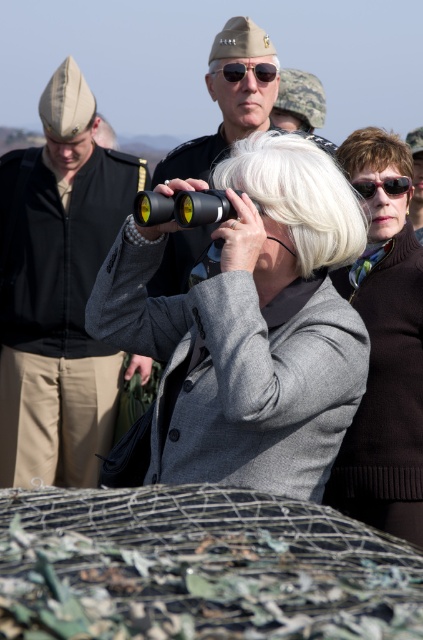
Question: Which object appears farthest from the camera in this image?

Choices:
 (A) black plastic sunglasses at upper center
 (B) gray matte jacket at center
 (C) black reflective sunglasses at center
 (D) brushed metal hat at left

Answer: (D)

Question: Considering the real-world distances, which object is closest to the brushed metal hat at left?

Choices:
 (A) matte black sunglasses at upper center
 (B) black plastic sunglasses at upper center

Answer: (B)

Question: Is white matte wig at center bigger than black reflective sunglasses at center?

Choices:
 (A) no
 (B) yes

Answer: (B)

Question: Considering the relative positions of matte black sunglasses at upper center and black plastic sunglasses at upper center in the image provided, where is matte black sunglasses at upper center located with respect to black plastic sunglasses at upper center?

Choices:
 (A) below
 (B) above

Answer: (B)

Question: In this image, where is brushed metal hat at left located relative to black reflective sunglasses at center?

Choices:
 (A) above
 (B) below

Answer: (B)

Question: Which is farther from the black reflective sunglasses at center?

Choices:
 (A) matte black sunglasses at upper center
 (B) white synthetic wig at upper right

Answer: (A)